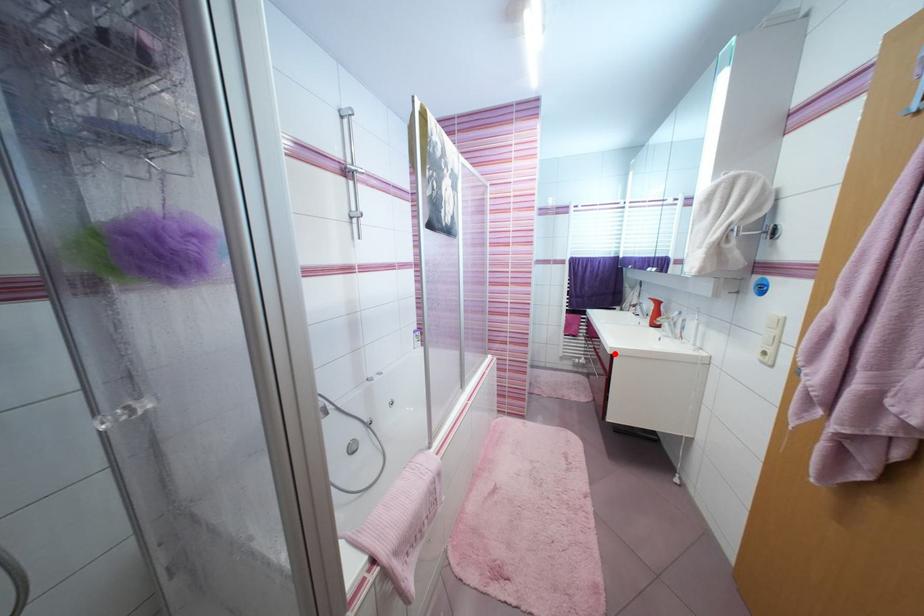
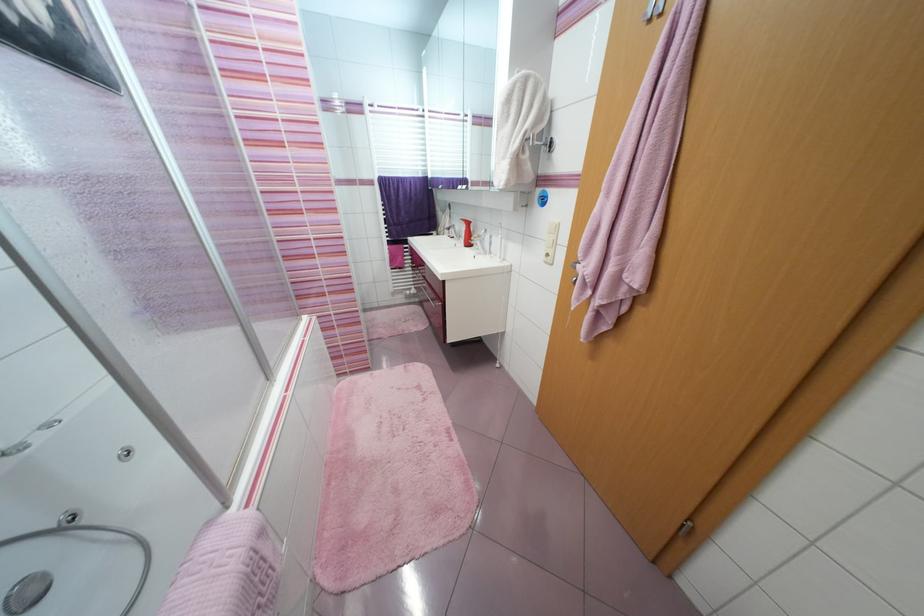
In the second image, find the point that corresponds to the highlighted location in the first image.

(445, 281)